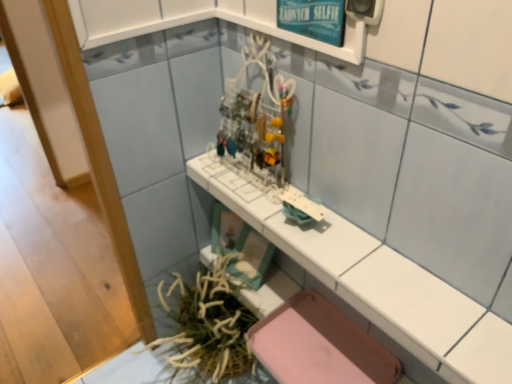
This screenshot has width=512, height=384. Describe the element at coordinates (292, 32) in the screenshot. I see `teal glossy signboard at upper center` at that location.

This screenshot has height=384, width=512. Identify the location of white glossy counter top at center. (380, 285).

Based on the photo, can you confirm if teal glossy signboard at upper center is positioned to the right of white glossy counter top at center?

In fact, teal glossy signboard at upper center is to the left of white glossy counter top at center.

Is teal glossy signboard at upper center inside or outside of white glossy counter top at center?

teal glossy signboard at upper center exists outside the volume of white glossy counter top at center.

From the image's perspective, does white glossy counter top at center appear lower than teal glossy signboard at upper center?

Yes, from the image's perspective, white glossy counter top at center is below teal glossy signboard at upper center.

What are the coordinates of `counter top in front of the teal glossy signboard at upper center` in the screenshot? It's located at (380, 285).

Could you tell me if white glossy counter top at center is facing teal glossy signboard at upper center?

No, white glossy counter top at center is not turned towards teal glossy signboard at upper center.

From the picture: Can you confirm if teal glossy signboard at upper center is thinner than green leafy plant at lower left?

Indeed, teal glossy signboard at upper center has a lesser width compared to green leafy plant at lower left.

From the image's perspective, is teal glossy signboard at upper center located beneath green leafy plant at lower left?

Incorrect, from the image's perspective, teal glossy signboard at upper center is higher than green leafy plant at lower left.

Looking at this image, who is shorter, teal glossy signboard at upper center or green leafy plant at lower left?

teal glossy signboard at upper center.

In the image, is teal glossy signboard at upper center on the left side or the right side of green leafy plant at lower left?

teal glossy signboard at upper center is to the right of green leafy plant at lower left.

Which object is further away from the camera, green leafy plant at lower left or teal glossy signboard at upper center?

Positioned behind is green leafy plant at lower left.

Which is farther from the camera, (218, 319) or (349, 44)?

The point (218, 319) is behind.

Considering the relative sizes of green leafy plant at lower left and teal glossy signboard at upper center in the image provided, is green leafy plant at lower left shorter than teal glossy signboard at upper center?

Incorrect, the height of green leafy plant at lower left does not fall short of that of teal glossy signboard at upper center.

At what (x,y) coordinates should I click in order to perform the action: click on plant behind the white glossy counter top at center. Please return your answer as a coordinate pair (x, y). The width and height of the screenshot is (512, 384). Looking at the image, I should click on (209, 324).

Is white glossy counter top at center in contact with green leafy plant at lower left?

No, white glossy counter top at center is not making contact with green leafy plant at lower left.

What's the angular difference between white glossy counter top at center and green leafy plant at lower left's facing directions?

0.756 degrees separate the facing orientations of white glossy counter top at center and green leafy plant at lower left.

From a real-world perspective, is white glossy counter top at center under green leafy plant at lower left?

Incorrect, from a real-world perspective, white glossy counter top at center is higher than green leafy plant at lower left.

Is green leafy plant at lower left outside of white glossy counter top at center?

Absolutely, green leafy plant at lower left is external to white glossy counter top at center.

From the image's perspective, is green leafy plant at lower left above white glossy counter top at center?

No, from the image's perspective, green leafy plant at lower left is not above white glossy counter top at center.

Is point (225, 330) closer to camera compared to point (423, 284)?

No, (225, 330) is further to viewer.

Looking at this image, does green leafy plant at lower left appear on the left side of white glossy counter top at center?

Yes, green leafy plant at lower left is to the left of white glossy counter top at center.

Find the location of a particular element. shelf behind the white glossy counter top at center is located at coordinates click(292, 32).

Image resolution: width=512 pixels, height=384 pixels. I want to click on counter top below the teal glossy signboard at upper center (from a real-world perspective), so click(380, 285).

When comparing their distances from teal glossy signboard at upper center, does green leafy plant at lower left or white glossy counter top at center seem further?

Based on the image, green leafy plant at lower left appears to be further to teal glossy signboard at upper center.

When comparing their distances from green leafy plant at lower left, does white glossy counter top at center or teal glossy signboard at upper center seem closer?

The object closer to green leafy plant at lower left is white glossy counter top at center.

When comparing their distances from white glossy counter top at center, does green leafy plant at lower left or teal glossy signboard at upper center seem closer?

Among the two, teal glossy signboard at upper center is located nearer to white glossy counter top at center.

Looking at the image, which one is located closer to white glossy counter top at center, teal glossy signboard at upper center or green leafy plant at lower left?

Based on the image, teal glossy signboard at upper center appears to be nearer to white glossy counter top at center.

Looking at the image, which one is located further to teal glossy signboard at upper center, white glossy counter top at center or green leafy plant at lower left?

green leafy plant at lower left.

Estimate the real-world distances between objects in this image. Which object is closer to green leafy plant at lower left, teal glossy signboard at upper center or white glossy counter top at center?

Among the two, white glossy counter top at center is located nearer to green leafy plant at lower left.

What are the coordinates of `counter top between teal glossy signboard at upper center and green leafy plant at lower left vertically` in the screenshot? It's located at (380, 285).